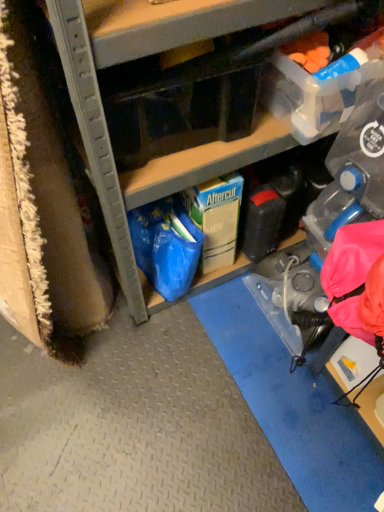
Question: From the image's perspective, is matte cardboard box at center located above or below translucent plastic storage box at upper right, the 2th storage box when ordered from back to front?

Choices:
 (A) above
 (B) below

Answer: (A)

Question: Considering the positions of point (91, 64) and point (322, 117), is point (91, 64) closer or farther from the camera than point (322, 117)?

Choices:
 (A) farther
 (B) closer

Answer: (B)

Question: Estimate the real-world distances between objects in this image. Which object is farther from the translucent plastic storage box at upper right, arranged as the second storage box when viewed from the front?

Choices:
 (A) matte cardboard box at center
 (B) transparent plastic storage box at upper center, which is counted as the first storage box, starting from the front
 (C) green cardboard box at center, the first storage box positioned from the back

Answer: (C)

Question: Which is nearer to the translucent plastic storage box at upper right, arranged as the second storage box when viewed from the front?

Choices:
 (A) green cardboard box at center, the third storage box from the front
 (B) transparent plastic storage box at upper center, the third storage box in the back-to-front sequence
 (C) matte cardboard box at center

Answer: (C)